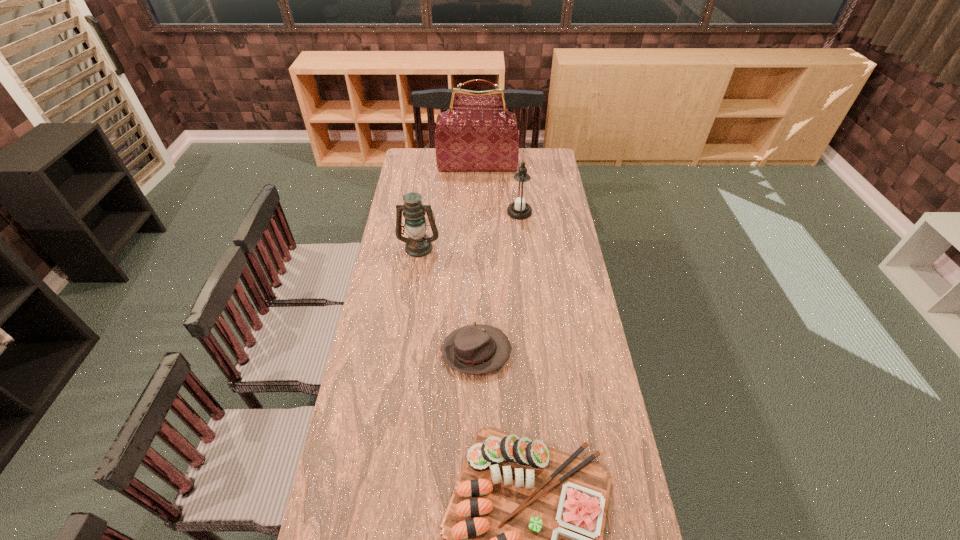
Identify the location of free area in between the fourth nearest object and the tallest object. (498, 189).

Locate an element on the screen. This screenshot has width=960, height=540. free space between the second nearest object and the left oil lamp is located at coordinates (447, 300).

Select which object is the third closest to the farthest object. Please provide its 2D coordinates. Your answer should be formatted as a tuple, i.e. [(x, y)], where the tuple contains the x and y coordinates of a point satisfying the conditions above.

[(476, 349)]

Locate which object ranks third in proximity to the third tallest object. Please provide its 2D coordinates. Your answer should be formatted as a tuple, i.e. [(x, y)], where the tuple contains the x and y coordinates of a point satisfying the conditions above.

[(477, 133)]

Identify the location of vacant space that satisfies the following two spatial constraints: 1. on the front-facing side of the farthest object; 2. on the left side of the fourth nearest object. Image resolution: width=960 pixels, height=540 pixels. (477, 212).

Locate an element on the screen. vacant point that satisfies the following two spatial constraints: 1. on the back side of the third tallest object; 2. on the right side of the farther oil lamp is located at coordinates (424, 212).